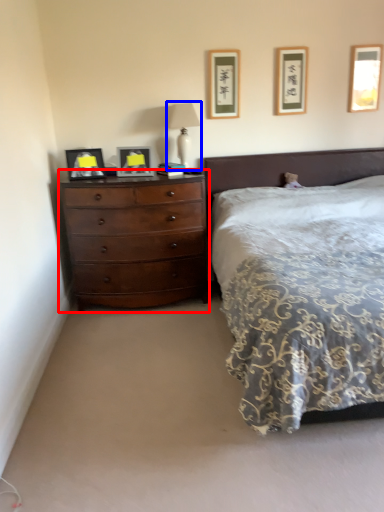
Question: Which of the following is the closest to the observer, chest of drawers (highlighted by a red box) or bedside lamp (highlighted by a blue box)?

Choices:
 (A) chest of drawers
 (B) bedside lamp

Answer: (A)